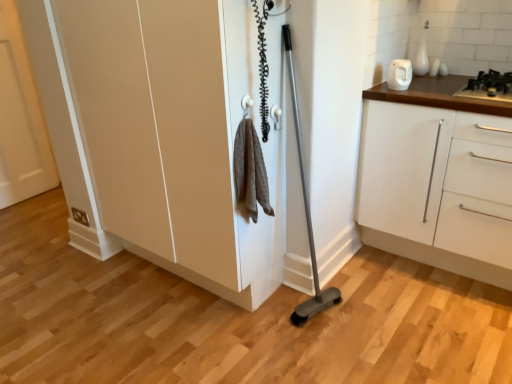
In order to click on vacant space to the left of matte white cupboard at center in this screenshot , I will do `click(74, 299)`.